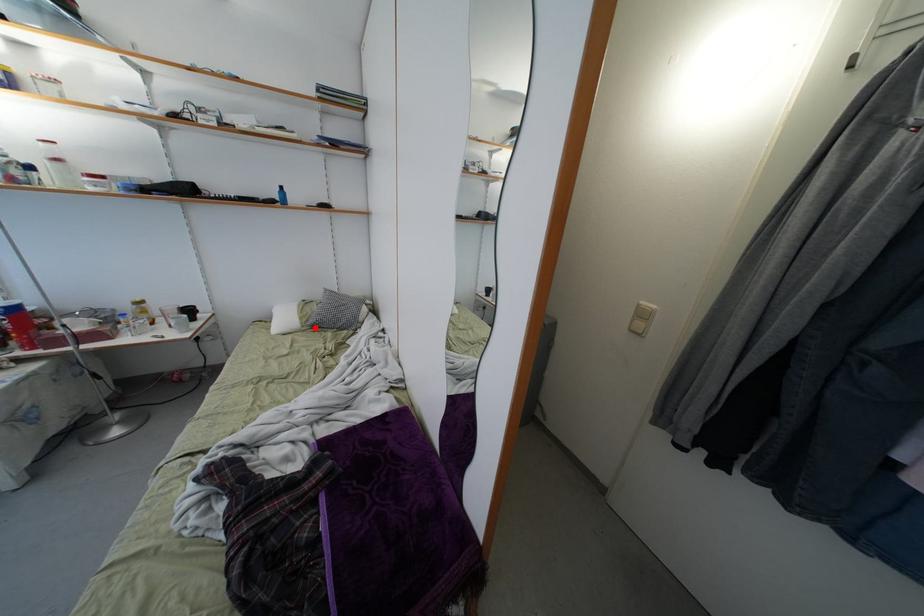
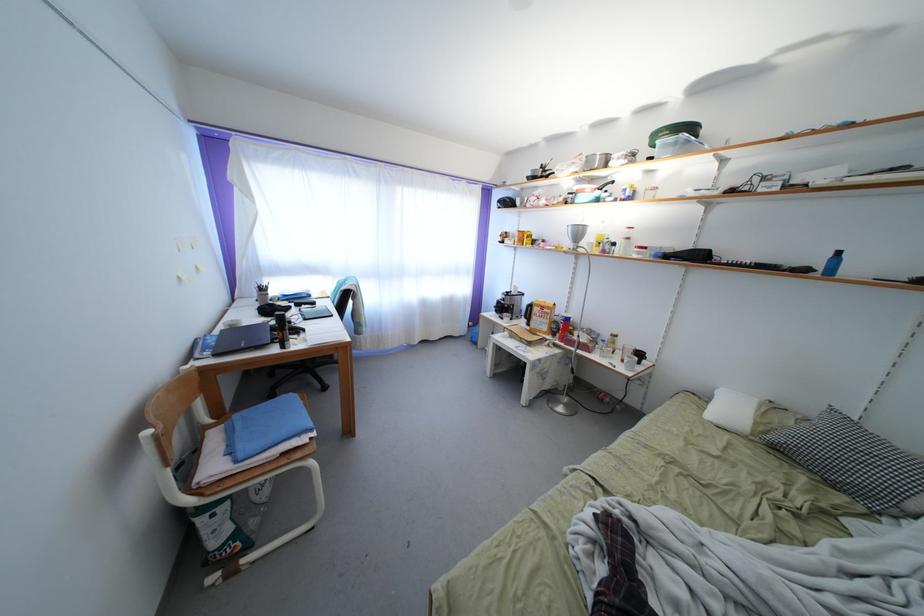
In the second image, find the point that corresponds to the highlighted location in the first image.

(779, 444)